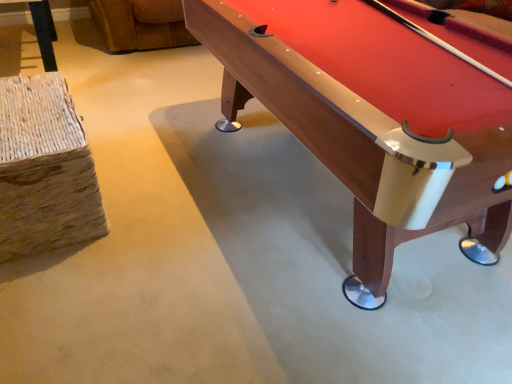
Find the location of a particular element. This screenshot has height=384, width=512. spots to the right of woven straw stool at left is located at coordinates (175, 206).